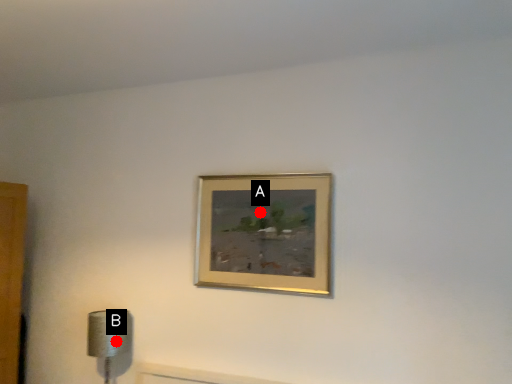
Question: Two points are circled on the image, labeled by A and B beside each circle. Which of the following is the closest to the observer?

Choices:
 (A) A is closer
 (B) B is closer

Answer: (A)